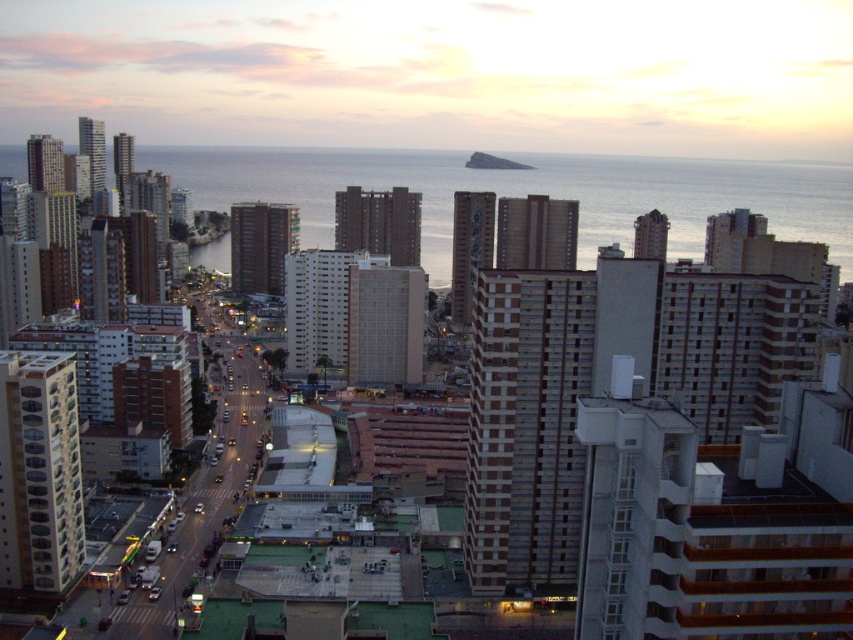
You are a delivery drone operator who needs to fly a drone from the matte brown building at center to the blue water at left. The drone has a maximum flight distance of 150 feet. Can the drone complete the delivery without needing to recharge?

The matte brown building at center and blue water at left are 169.79 feet apart, which exceeds the drone maximum flight distance of 150 feet. The drone cannot complete the delivery without needing to recharge.

You are standing at the point marked as point (234, 100) in the image. A friend is located at your current position and wants to know how far they are from you. What should you tell them?

The distance between point (234, 100) and the viewer is 574.97 meters, so you should inform your friend that they are 574.97 meters away from you.